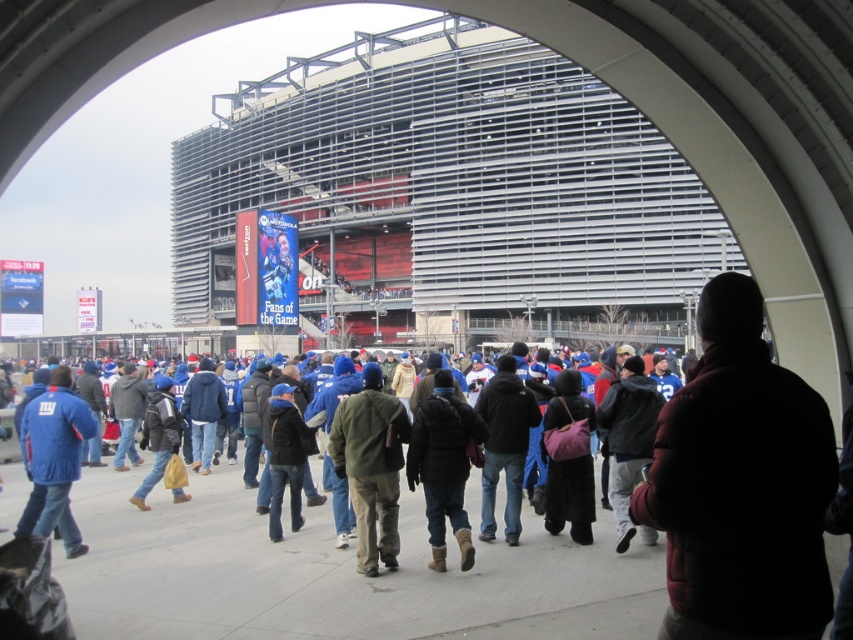
Question: Estimate the real-world distances between objects in this image. Which object is farther from the dark red puffy coat at center?

Choices:
 (A) matte blue jacket at center-left
 (B) green matte jacket at center

Answer: (A)

Question: Which of these objects is positioned closest to the matte blue jacket at center-left?

Choices:
 (A) dark brown leather jacket at center
 (B) dark red puffy coat at center
 (C) green matte jacket at center

Answer: (C)

Question: Is green matte jacket at center further to the viewer compared to matte blue jacket at center-left?

Choices:
 (A) yes
 (B) no

Answer: (A)

Question: Can you confirm if dark red puffy coat at center is positioned to the left of dark brown leather jacket at center?

Choices:
 (A) yes
 (B) no

Answer: (B)

Question: In this image, where is dark red puffy coat at center located relative to dark brown leather jacket at center?

Choices:
 (A) left
 (B) right

Answer: (B)

Question: Which point is closer to the camera?

Choices:
 (A) green matte jacket at center
 (B) dark red puffy coat at center
 (C) dark brown leather jacket at center
 (D) matte blue jacket at center-left

Answer: (B)